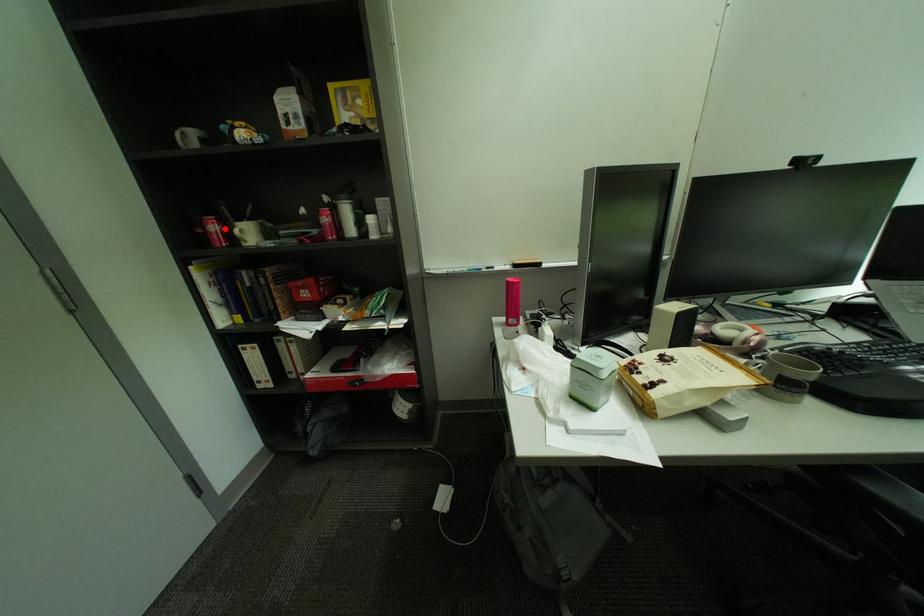
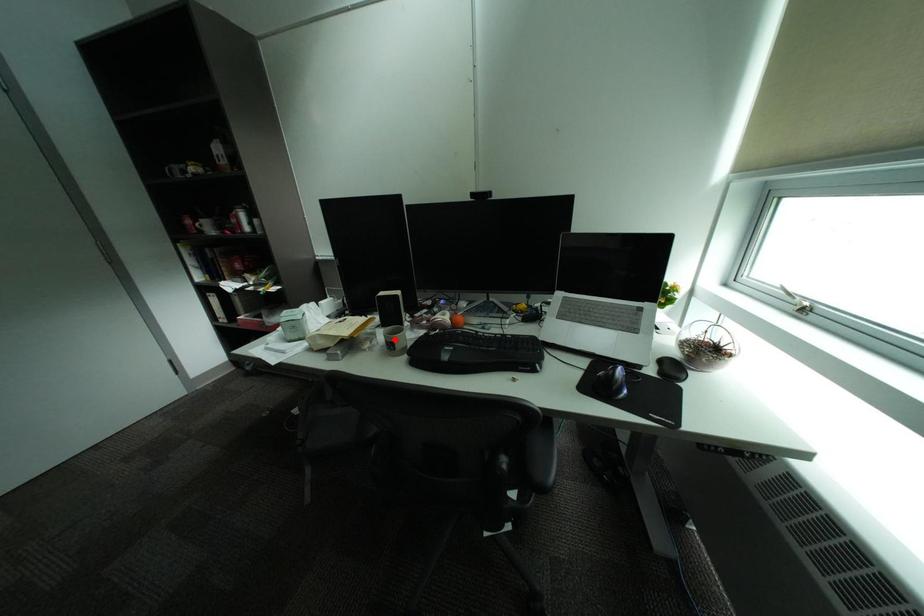
I am providing you with two images of the same scene from different viewpoints. A red point is marked on the first image and another point is marked on the second image. Does the point marked in image1 correspond to the same location as the one in image2?

No